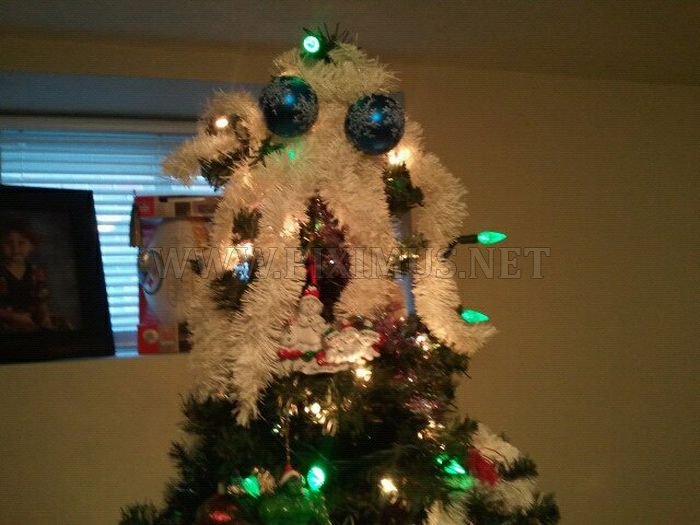
Where is `blue ornament`? blue ornament is located at coordinates (365, 136).